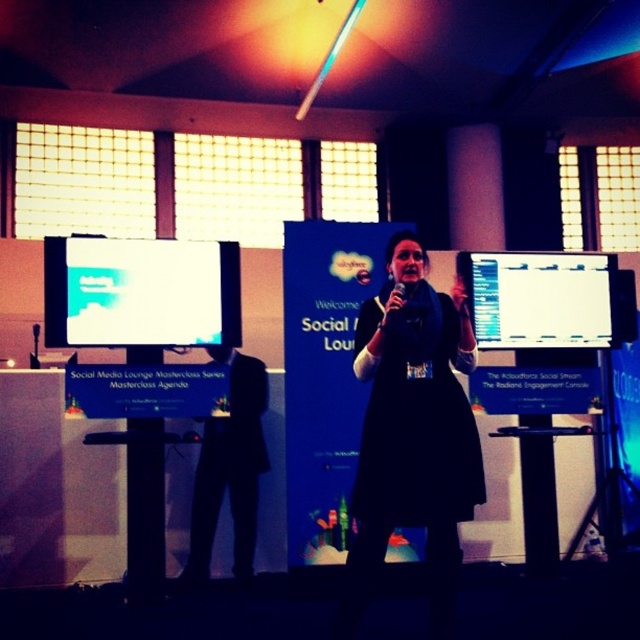
Which is in front, point (172, 333) or point (529, 316)?

Point (172, 333) is in front.

Which is above, white glossy projector screen at left or white glossy monitor at center?

white glossy projector screen at left is higher up.

Where is `white glossy projector screen at left`? The image size is (640, 640). white glossy projector screen at left is located at coordinates (140, 292).

Is the position of black matte dress at center more distant than that of white glossy projector screen at left?

That is False.

Does black matte dress at center appear over white glossy projector screen at left?

No.

Is point (468, 321) behind point (163, 243)?

No.

This screenshot has height=640, width=640. I want to click on black matte dress at center, so click(413, 429).

Based on the photo, how much distance is there between white glossy projector screen at left and black suit at center?

white glossy projector screen at left and black suit at center are 26.16 inches apart.

You are a GUI agent. You are given a task and a screenshot of the screen. Output one action in this format:
    pyautogui.click(x=<x>, y=<y>)
    Task: Click on the white glossy projector screen at left
    
    Given the screenshot: What is the action you would take?
    pyautogui.click(x=140, y=292)